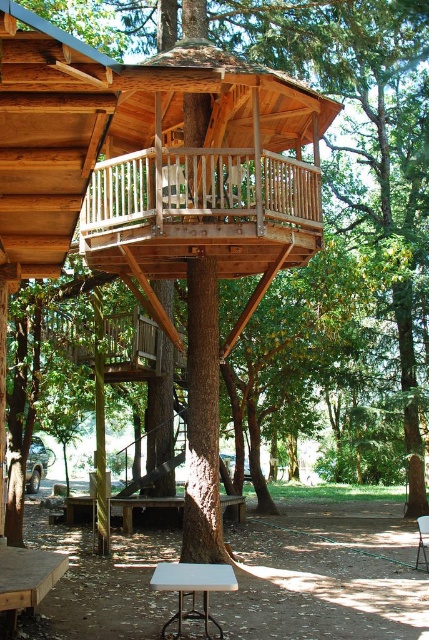
You are standing at the center of the treehouse balcony. You want to place a new bench exactly at the same 2D location as the white plastic picnic table at lower left. What are the coordinates you should aim for?

The coordinates for the white plastic picnic table at lower left are at point (x=27, y=579). So you should aim for those coordinates to place the new bench.

You are planning to set up a small campsite near the treehouse. You have a white plastic picnic table at lower left and a metallic folding chair at center. Which object is positioned more to the east if the treehouse faces north?

The white plastic picnic table at lower left is positioned to the left of the metallic folding chair at center. Since the treehouse faces north, left would correspond to the west direction. Therefore, the white plastic picnic table at lower left is more to the west, making the metallic folding chair at center the easternmost object between the two.

From the picture: You are standing at point (x=45, y=554) and want to reach the treehouse entrance located at point 0.133, 0.900. The treehouse is built around a large tree trunk. Can you walk directly to the entrance without any obstacles?

The distance between point (x=45, y=554) and point 0.133, 0.900 is 6.99 meters. Since the treehouse is built around a large tree trunk, there might be obstacles like the tree trunk itself or structural supports in between, so you cannot walk directly to the entrance without any obstacles.